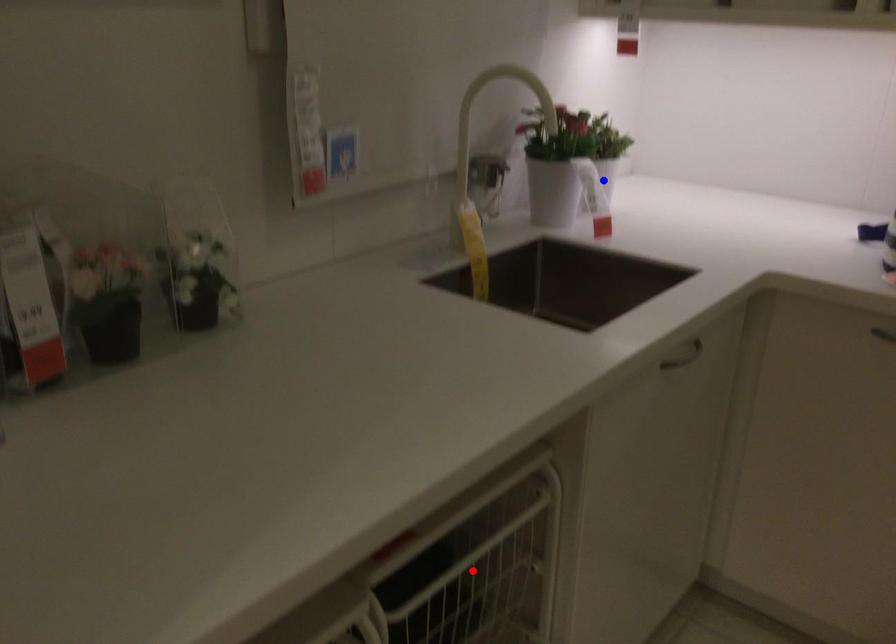
Question: In the image, two points are highlighted. Which point is nearer to the camera? Reply with the corresponding letter.

Choices:
 (A) blue point
 (B) red point

Answer: (B)